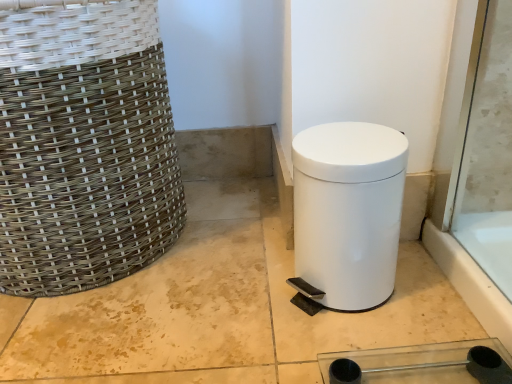
This screenshot has height=384, width=512. I want to click on vacant space to the right of white woven basket at left, so click(241, 261).